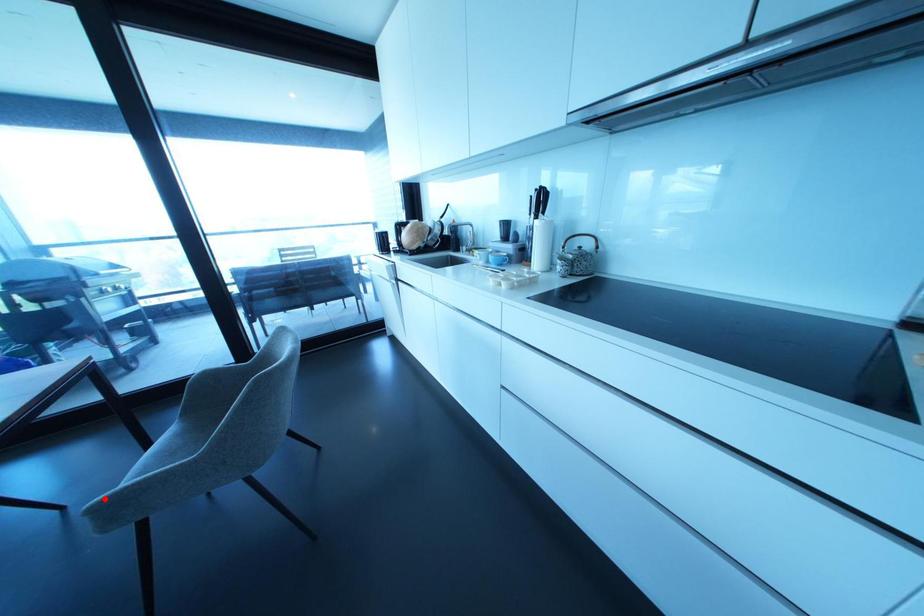
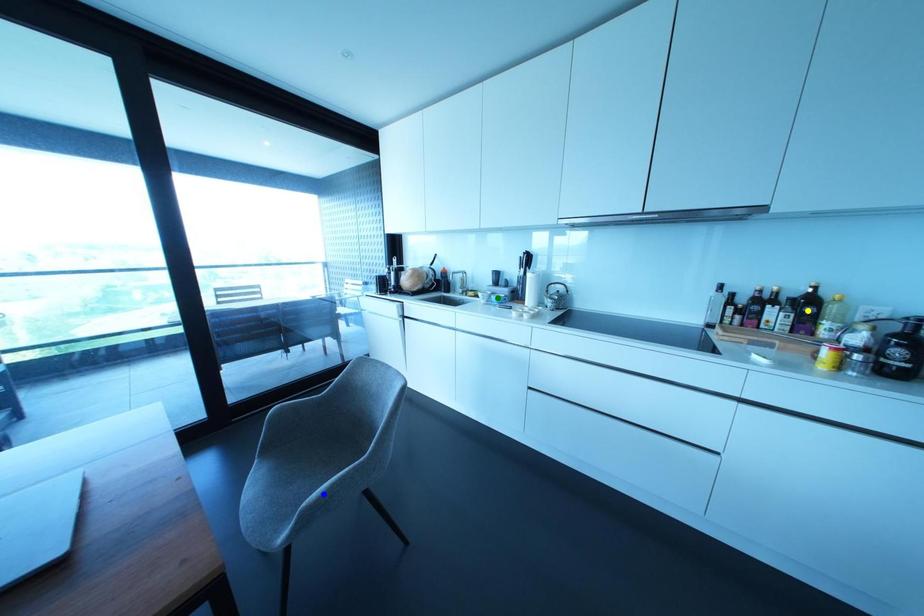
Question: I am providing you with two images of the same scene from different viewpoints. A red point is marked on the first image. You are given multiple points on the second image. Can you choose the point in image 2 that corresponds to the point in image 1?

Choices:
 (A) yellow point
 (B) blue point
 (C) green point

Answer: (B)